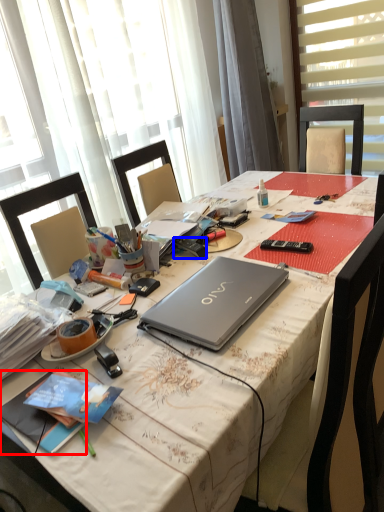
Question: Which of the following is the farthest to the observer, book (highlighted by a red box) or remote control (highlighted by a blue box)?

Choices:
 (A) book
 (B) remote control

Answer: (B)